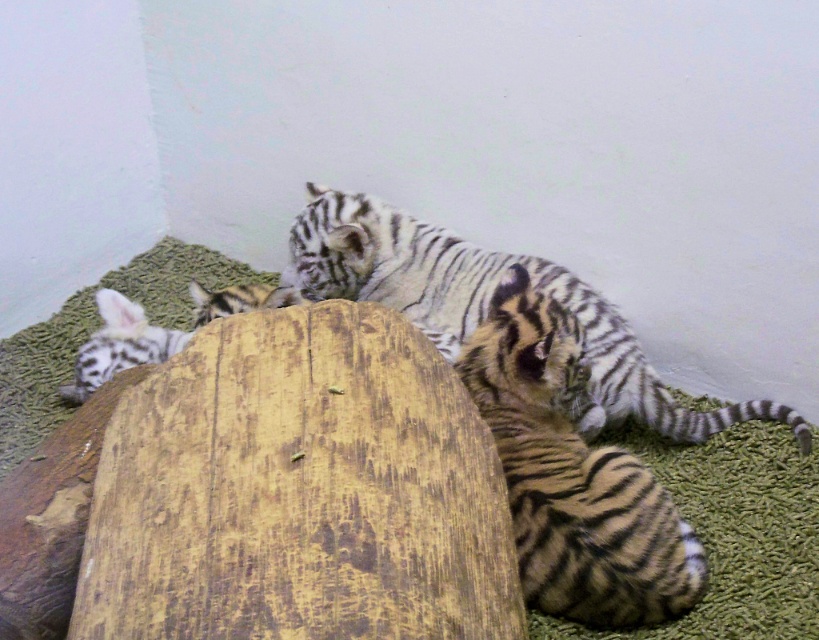
You are a zookeeper who needs to feed the striped fur tiger at lower right and the striped fur tiger at lower left. Since you can only reach one at a time, which tiger should you feed first if you want to avoid bending down more than necessary?

The striped fur tiger at lower left is above the striped fur tiger at lower right, so you should feed the striped fur tiger at lower left first without bending down as much.

You are a zookeeper who needs to place a feeding bowl for the striped fur tiger at center. The enclosure has a feeding zone marked at point (486, 305). Is the feeding bowl within the feeding zone?

The point (486, 305) corresponds to the striped fur tiger at center, so placing the feeding bowl there would position it directly where the tiger is located. The feeding zone should be a separate area away from where the animal is currently situated.

You are a zookeeper observing two tiger cubs in their enclosure. You notice the striped fur tiger at lower right and the striped fur tiger at center. Which of these two cubs is taller?

The striped fur tiger at lower right is taller than the striped fur tiger at center.